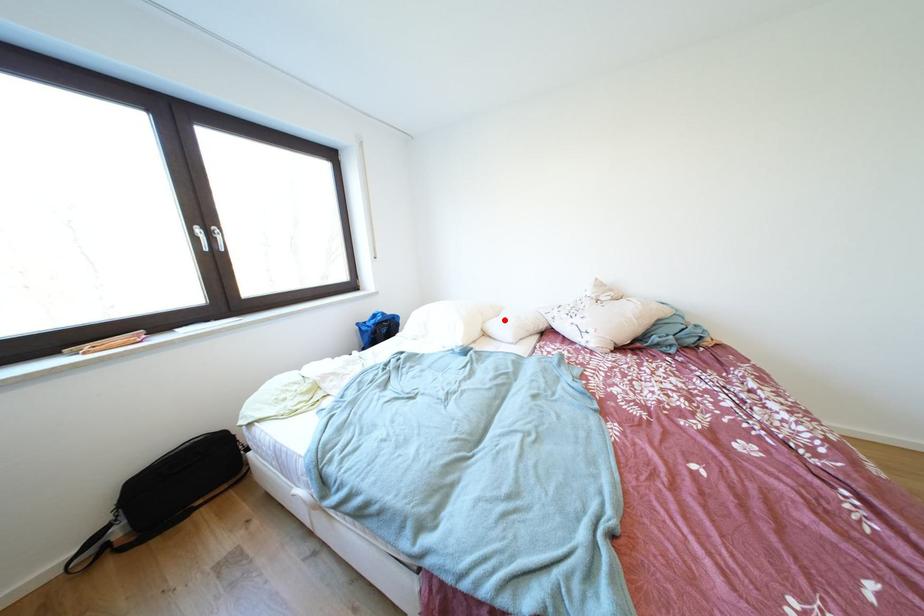
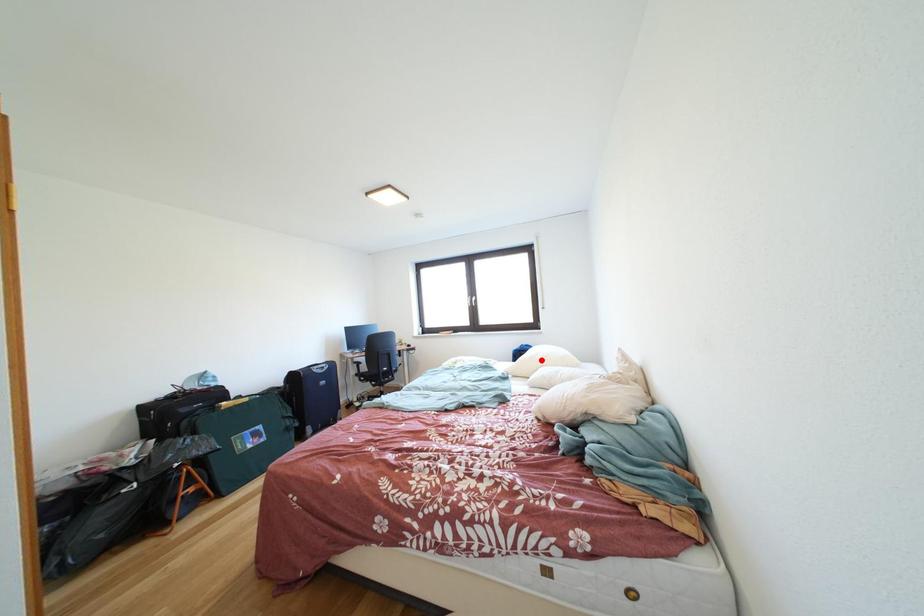
I am providing you with two images of the same scene from different viewpoints. A red point is marked on the first image and another point is marked on the second image. Is the marked point in image1 the same physical position as the marked point in image2?

No